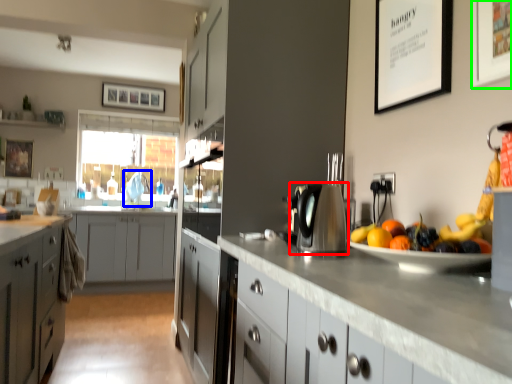
Question: Which object is the farthest from kitchen appliance (highlighted by a red box)? Choose among these: faucet (highlighted by a blue box) or picture frame (highlighted by a green box).

Choices:
 (A) faucet
 (B) picture frame

Answer: (A)